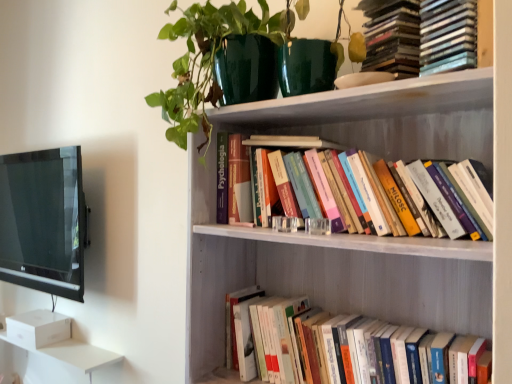
Based on the photo, how much space does hardcover books at upper center, which appears as the 2th book when ordered from the bottom, occupy vertically?

The height of hardcover books at upper center, which appears as the 2th book when ordered from the bottom, is 28.62 centimeters.

What is the approximate width of hardcover books at upper center, marked as the second book in a top-to-bottom arrangement?

It is 22.17 centimeters.

Measure the distance between hardcover books at upper right, placed as the first book when sorted from top to bottom, and camera.

33.41 inches.

The height and width of the screenshot is (384, 512). Describe the element at coordinates (42, 221) in the screenshot. I see `black glossy tv at left` at that location.

Identify the location of black glossy tv at left. Image resolution: width=512 pixels, height=384 pixels. (42, 221).

Describe the element at coordinates (208, 59) in the screenshot. I see `green glossy pot at upper center` at that location.

Find the location of a particular element. Image resolution: width=512 pixels, height=384 pixels. hardcover books at upper center, marked as the second book in a top-to-bottom arrangement is located at coordinates (411, 198).

From the image's perspective, is hardcover books at lower right, the 3th book in the top-to-bottom sequence, located above green glossy pot at upper center?

Actually, hardcover books at lower right, the 3th book in the top-to-bottom sequence, appears below green glossy pot at upper center in the image.

Is hardcover books at lower right, which ranks as the 1th book in bottom-to-top order, surrounding green glossy pot at upper center?

No, green glossy pot at upper center is not a part of hardcover books at lower right, which ranks as the 1th book in bottom-to-top order.

Who is smaller, hardcover books at lower right, which ranks as the 1th book in bottom-to-top order, or green glossy pot at upper center?

hardcover books at lower right, which ranks as the 1th book in bottom-to-top order.

Which is more to the left, hardcover books at lower right, which ranks as the 1th book in bottom-to-top order, or green glossy pot at upper center?

green glossy pot at upper center.

This screenshot has height=384, width=512. In order to click on plant that is above the hardcover books at upper center, marked as the second book in a top-to-bottom arrangement (from a real-world perspective) in this screenshot , I will do `click(208, 59)`.

Is hardcover books at upper center, marked as the second book in a top-to-bottom arrangement, to the left of green glossy pot at upper center from the viewer's perspective?

Incorrect, hardcover books at upper center, marked as the second book in a top-to-bottom arrangement, is not on the left side of green glossy pot at upper center.

Which of these two, hardcover books at upper center, which appears as the 2th book when ordered from the bottom, or green glossy pot at upper center, is wider?

Wider between the two is green glossy pot at upper center.

Is hardcover books at upper center, which appears as the 2th book when ordered from the bottom, oriented away from green glossy pot at upper center?

No, hardcover books at upper center, which appears as the 2th book when ordered from the bottom,'s orientation is not away from green glossy pot at upper center.

Which object is further away from the camera taking this photo, hardcover books at upper right, the third book in the bottom-to-top sequence, or hardcover books at lower right, the 3th book in the top-to-bottom sequence?

hardcover books at upper right, the third book in the bottom-to-top sequence.

Is hardcover books at upper right, placed as the first book when sorted from top to bottom, positioned far away from hardcover books at lower right, the 3th book in the top-to-bottom sequence?

No, hardcover books at upper right, placed as the first book when sorted from top to bottom, is not far away from hardcover books at lower right, the 3th book in the top-to-bottom sequence.

Which point is more distant from viewer, (438, 16) or (393, 361)?

The point (393, 361) is more distant.

Which is correct: hardcover books at upper right, placed as the first book when sorted from top to bottom, is inside hardcover books at upper center, which appears as the 2th book when ordered from the bottom, or outside of it?

hardcover books at upper right, placed as the first book when sorted from top to bottom, is not enclosed by hardcover books at upper center, which appears as the 2th book when ordered from the bottom.

Is hardcover books at upper center, which appears as the 2th book when ordered from the bottom, at the back of hardcover books at upper right, the third book in the bottom-to-top sequence?

hardcover books at upper right, the third book in the bottom-to-top sequence, does not have its back to hardcover books at upper center, which appears as the 2th book when ordered from the bottom.

Is there a large distance between hardcover books at upper right, placed as the first book when sorted from top to bottom, and hardcover books at upper center, marked as the second book in a top-to-bottom arrangement?

That's not correct — hardcover books at upper right, placed as the first book when sorted from top to bottom, is a little close to hardcover books at upper center, marked as the second book in a top-to-bottom arrangement.

Is hardcover books at upper right, the third book in the bottom-to-top sequence, thinner than hardcover books at upper center, which appears as the 2th book when ordered from the bottom?

Correct, the width of hardcover books at upper right, the third book in the bottom-to-top sequence, is less than that of hardcover books at upper center, which appears as the 2th book when ordered from the bottom.

Considering the relative sizes of hardcover books at upper right, the third book in the bottom-to-top sequence, and black glossy tv at left in the image provided, is hardcover books at upper right, the third book in the bottom-to-top sequence, taller than black glossy tv at left?

No, hardcover books at upper right, the third book in the bottom-to-top sequence, is not taller than black glossy tv at left.

Does hardcover books at upper right, the third book in the bottom-to-top sequence, come in front of black glossy tv at left?

Yes.

Considering the relative positions of hardcover books at upper right, the third book in the bottom-to-top sequence, and black glossy tv at left in the image provided, is hardcover books at upper right, the third book in the bottom-to-top sequence, to the left or to the right of black glossy tv at left?

From the image, it's evident that hardcover books at upper right, the third book in the bottom-to-top sequence, is to the right of black glossy tv at left.

How far apart are hardcover books at upper right, the third book in the bottom-to-top sequence, and black glossy tv at left?

hardcover books at upper right, the third book in the bottom-to-top sequence, is 2.26 meters away from black glossy tv at left.

From the image's perspective, which object appears higher, hardcover books at upper right, placed as the first book when sorted from top to bottom, or green glossy pot at upper center?

hardcover books at upper right, placed as the first book when sorted from top to bottom, appears higher in the image.

Considering the relative positions of hardcover books at upper right, the third book in the bottom-to-top sequence, and green glossy pot at upper center in the image provided, is hardcover books at upper right, the third book in the bottom-to-top sequence, to the left of green glossy pot at upper center from the viewer's perspective?

Incorrect, hardcover books at upper right, the third book in the bottom-to-top sequence, is not on the left side of green glossy pot at upper center.

Is hardcover books at upper right, the third book in the bottom-to-top sequence, smaller than green glossy pot at upper center?

Indeed, hardcover books at upper right, the third book in the bottom-to-top sequence, has a smaller size compared to green glossy pot at upper center.

Can you tell me how much hardcover books at upper right, placed as the first book when sorted from top to bottom, and green glossy pot at upper center differ in facing direction?

There is a 29.9-degree angle between the facing directions of hardcover books at upper right, placed as the first book when sorted from top to bottom, and green glossy pot at upper center.

The height and width of the screenshot is (384, 512). In the image, there is a black glossy tv at left. In order to click on bookcase below it (from a real-world perspective) in this screenshot , I will do `click(357, 236)`.

Can you confirm if black glossy tv at left is wider than white wooden bookshelf at upper center?

Incorrect, the width of black glossy tv at left does not surpass that of white wooden bookshelf at upper center.

Which is more to the left, black glossy tv at left or white wooden bookshelf at upper center?

black glossy tv at left.

From a real-world perspective, which is physically below, black glossy tv at left or white wooden bookshelf at upper center?

From a 3D spatial view, white wooden bookshelf at upper center is below.

Locate an element on the screen. This screenshot has height=384, width=512. book that is the 2nd one below the green glossy pot at upper center (from a real-world perspective) is located at coordinates (341, 347).

Where is `book that is the 3rd object located in front of the green glossy pot at upper center`? This screenshot has width=512, height=384. book that is the 3rd object located in front of the green glossy pot at upper center is located at coordinates (411, 198).

Considering their positions, is white wooden bookshelf at upper center positioned closer to black glossy tv at left than hardcover books at upper center, which appears as the 2th book when ordered from the bottom?

white wooden bookshelf at upper center lies closer to black glossy tv at left than the other object.

Consider the image. Which object lies nearer to the anchor point black glossy tv at left, hardcover books at lower right, the 3th book in the top-to-bottom sequence, or green glossy pot at upper center?

Among the two, green glossy pot at upper center is located nearer to black glossy tv at left.

Estimate the real-world distances between objects in this image. Which object is further from hardcover books at upper right, the third book in the bottom-to-top sequence, green glossy pot at upper center or white wooden bookshelf at upper center?

green glossy pot at upper center is further to hardcover books at upper right, the third book in the bottom-to-top sequence.

From the image, which object appears to be nearer to hardcover books at upper right, placed as the first book when sorted from top to bottom, hardcover books at upper center, which appears as the 2th book when ordered from the bottom, or green glossy pot at upper center?

hardcover books at upper center, which appears as the 2th book when ordered from the bottom.

Considering their positions, is hardcover books at lower right, the 3th book in the top-to-bottom sequence, positioned closer to black glossy tv at left than hardcover books at upper center, marked as the second book in a top-to-bottom arrangement?

hardcover books at lower right, the 3th book in the top-to-bottom sequence, is closer to black glossy tv at left.

When comparing their distances from hardcover books at lower right, the 3th book in the top-to-bottom sequence, does hardcover books at upper right, the third book in the bottom-to-top sequence, or green glossy pot at upper center seem closer?

green glossy pot at upper center.

Looking at the image, which one is located further to hardcover books at upper right, placed as the first book when sorted from top to bottom, black glossy tv at left or green glossy pot at upper center?

black glossy tv at left is positioned further to the anchor hardcover books at upper right, placed as the first book when sorted from top to bottom.

Which object lies nearer to the anchor point green glossy pot at upper center, white wooden bookshelf at upper center or hardcover books at upper center, marked as the second book in a top-to-bottom arrangement?

white wooden bookshelf at upper center lies closer to green glossy pot at upper center than the other object.

At what (x,y) coordinates should I click in order to perform the action: click on book between black glossy tv at left and hardcover books at lower right, the 3th book in the top-to-bottom sequence, in the horizontal direction. Please return your answer as a coordinate pair (x, y). This screenshot has width=512, height=384. Looking at the image, I should click on (411, 198).

Locate an element on the screen. The width and height of the screenshot is (512, 384). book between green glossy pot at upper center and hardcover books at lower right, the 3th book in the top-to-bottom sequence, in the vertical direction is located at coordinates (411, 198).

Where is `bookcase between black glossy tv at left and hardcover books at lower right, which ranks as the 1th book in bottom-to-top order`? bookcase between black glossy tv at left and hardcover books at lower right, which ranks as the 1th book in bottom-to-top order is located at coordinates (357, 236).

The height and width of the screenshot is (384, 512). I want to click on bookcase between hardcover books at upper center, which appears as the 2th book when ordered from the bottom, and hardcover books at lower right, the 3th book in the top-to-bottom sequence, from top to bottom, so click(x=357, y=236).